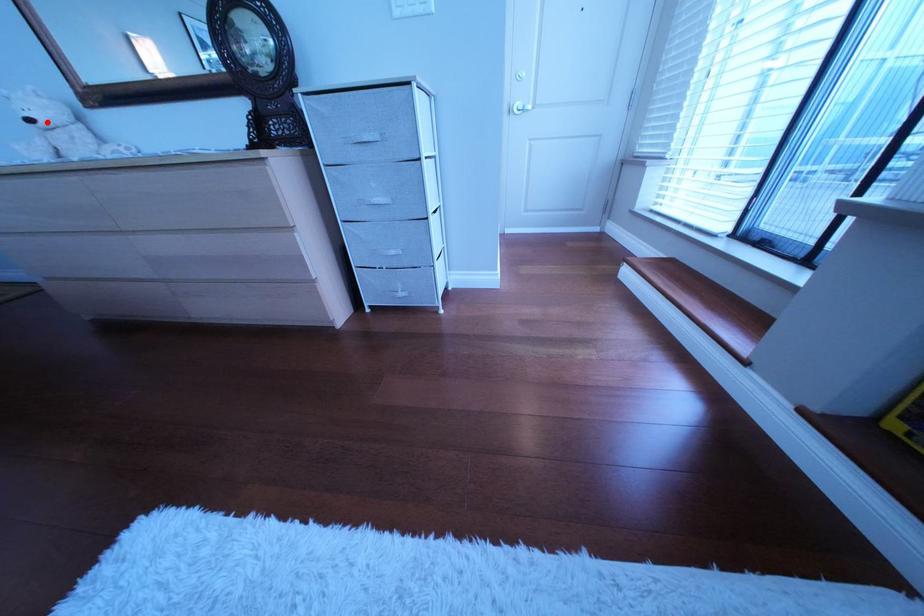
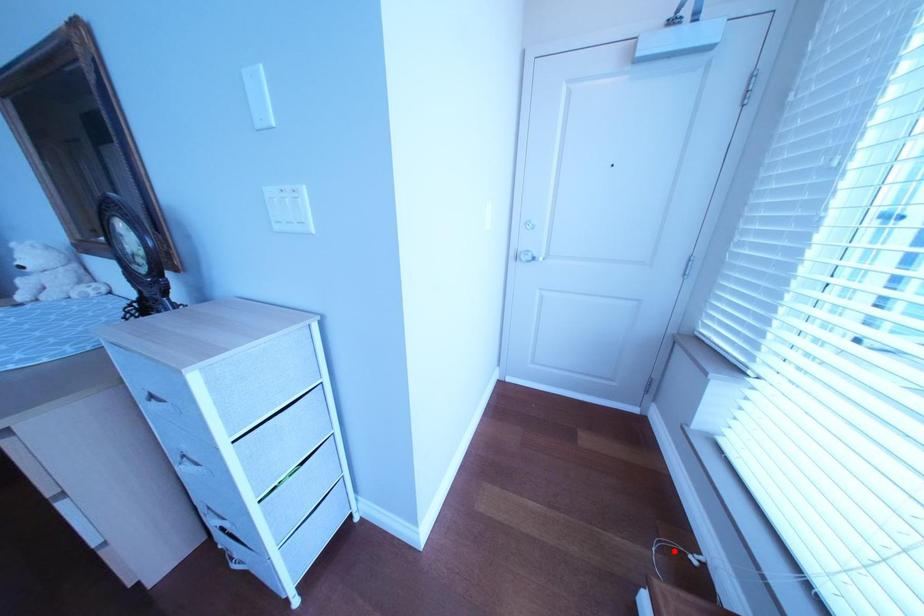
I am providing you with two images of the same scene from different viewpoints. A red point is marked on the first image and another point is marked on the second image. Are the points marked in image1 and image2 representing the same 3D position?

No